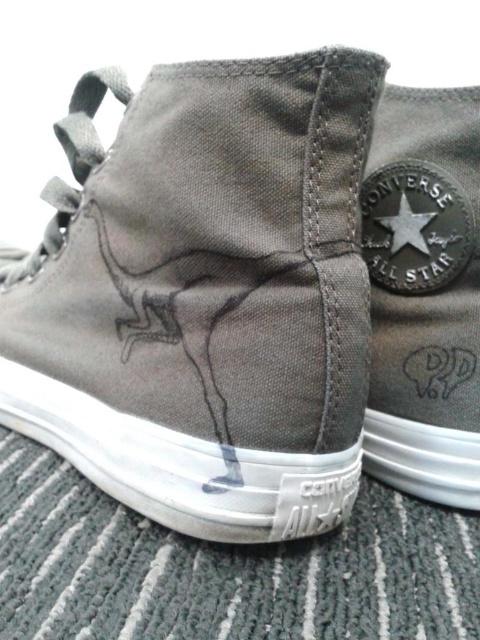
Does canvas high-top sneaker at center lie in front of matte canvas converse all star at center?

Yes, canvas high-top sneaker at center is closer to the viewer.

Is point (310, 504) closer to camera compared to point (412, 484)?

Yes, it is.

The image size is (480, 640). Identify the location of canvas high-top sneaker at center. (205, 296).

Where is `matte canvas converse all star at center`? matte canvas converse all star at center is located at coordinates (423, 292).

Does matte canvas converse all star at center have a greater height compared to metallic silver star at center?

Correct, matte canvas converse all star at center is much taller as metallic silver star at center.

This screenshot has height=640, width=480. What are the coordinates of `matte canvas converse all star at center` in the screenshot? It's located at (423, 292).

Measure the distance from canvas high-top sneaker at center to metallic silver star at center.

15.35 inches

Who is lower down, canvas high-top sneaker at center or metallic silver star at center?

canvas high-top sneaker at center is lower down.

Is point (294, 225) closer to camera compared to point (408, 243)?

Yes, point (294, 225) is in front of point (408, 243).

Image resolution: width=480 pixels, height=640 pixels. I want to click on canvas high-top sneaker at center, so click(205, 296).